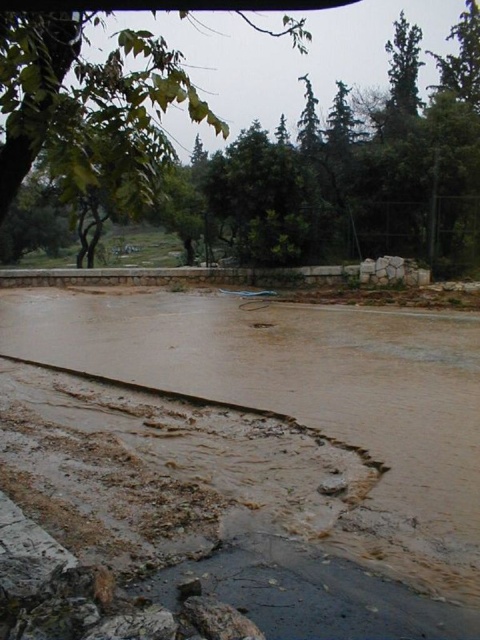
You are a hiker trying to navigate through the flooded area. You see the brown muddy water at lower left and the green leafy tree at upper left. Which object is closer to you as you stand in the scene?

The brown muddy water at lower left is closer to you because it is further to the viewer than the green leafy tree at upper left.

You are a surveyor trying to map the flooded area. You notice a point marked at coordinates (291, 374). What is the location of this point in the scene?

The point at (291, 374) corresponds to the brown muddy water at lower left.

You are standing at the center of the image and want to avoid stepping into the brown muddy water at lower left. Which direction should you move to stay away from it?

The brown muddy water at lower left is located at point [291,374]. Since you are at the center, moving in any direction away from the lower left quadrant would help avoid it. Moving towards the upper right would be the most direct path away from the brown muddy water at lower left.